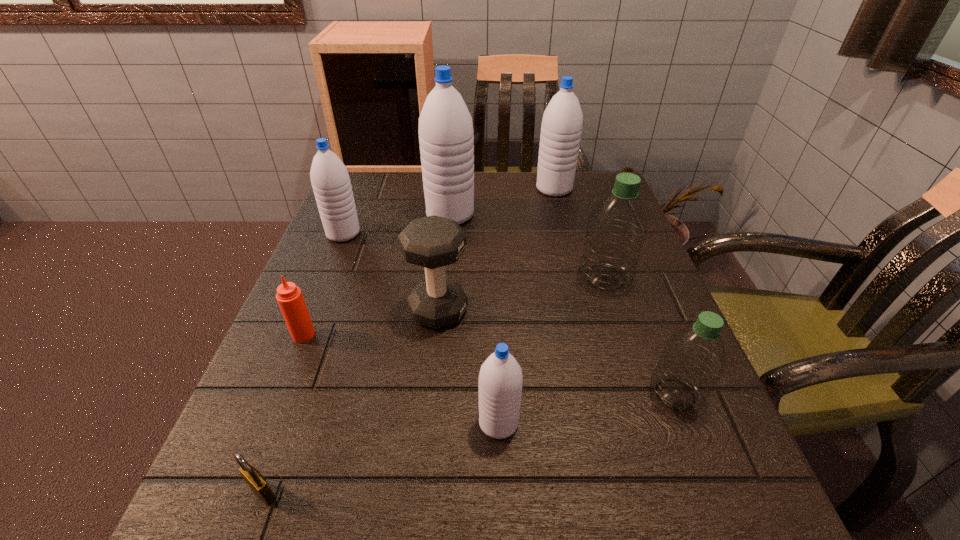
At what (x,y) coordinates should I click in order to perform the action: click on blank space that satisfies the following two spatial constraints: 1. on the back side of the nearer green water bottle; 2. on the right side of the second blue water bottle from right to left. Please return your answer as a coordinate pair (x, y). The image size is (960, 540). Looking at the image, I should click on (497, 395).

Where is `free space in the image that satisfies the following two spatial constraints: 1. on the front side of the third biggest blue water bottle; 2. on the left side of the dumbbell`? free space in the image that satisfies the following two spatial constraints: 1. on the front side of the third biggest blue water bottle; 2. on the left side of the dumbbell is located at coordinates (312, 311).

Identify the location of vacant space that satisfies the following two spatial constraints: 1. on the front side of the nearer green water bottle; 2. on the right side of the tallest object. The image size is (960, 540). (434, 395).

In order to click on free region that satisfies the following two spatial constraints: 1. on the back side of the third blue water bottle from right to left; 2. on the left side of the dumbbell in this screenshot , I will do pyautogui.click(x=448, y=215).